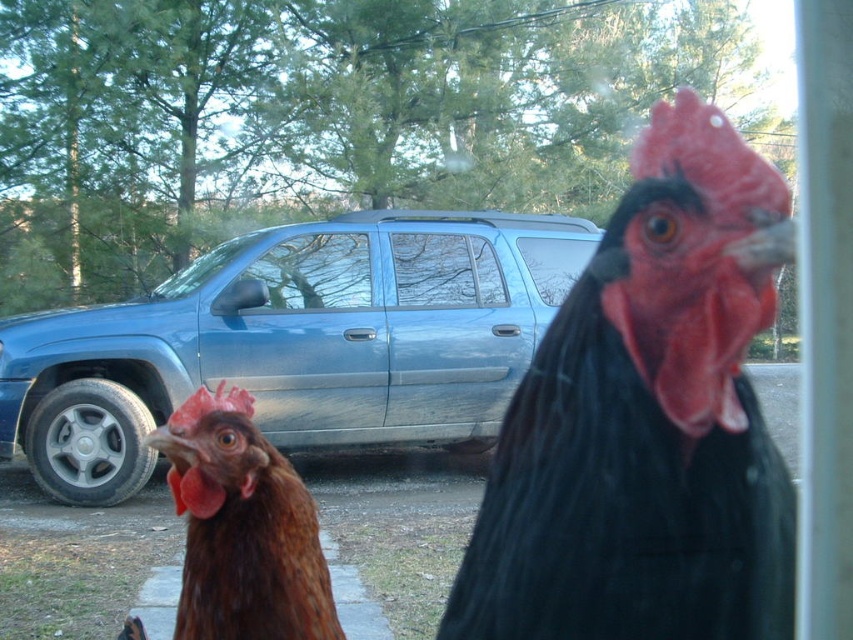
You are a photographer setting up a tripod to take a photo of the blue metallic car at center and the brown feathered chicken at lower left. Since you want both subjects to be in focus, you need to adjust the camera settings so that the depth of field can cover both. Considering their sizes, which subject requires you to focus closer to ensure sharpness?

The brown feathered chicken at lower left requires focusing closer because it is smaller than the blue metallic car at center, and to capture details of smaller objects, the focus needs to be adjusted closer.

You are a farmer checking the coop and notice the black glossy rooster at center and the brown feathered chicken at lower left. Which one is wider?

The black glossy rooster at center is wider than the brown feathered chicken at lower left.